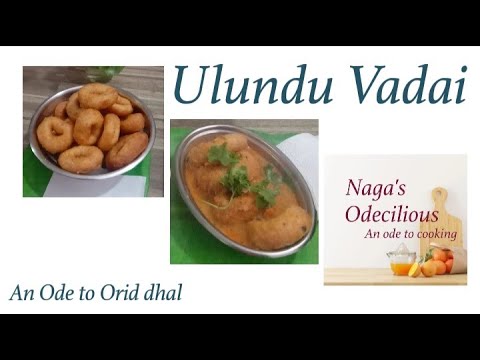
Identify the location of green mat. (195, 245).